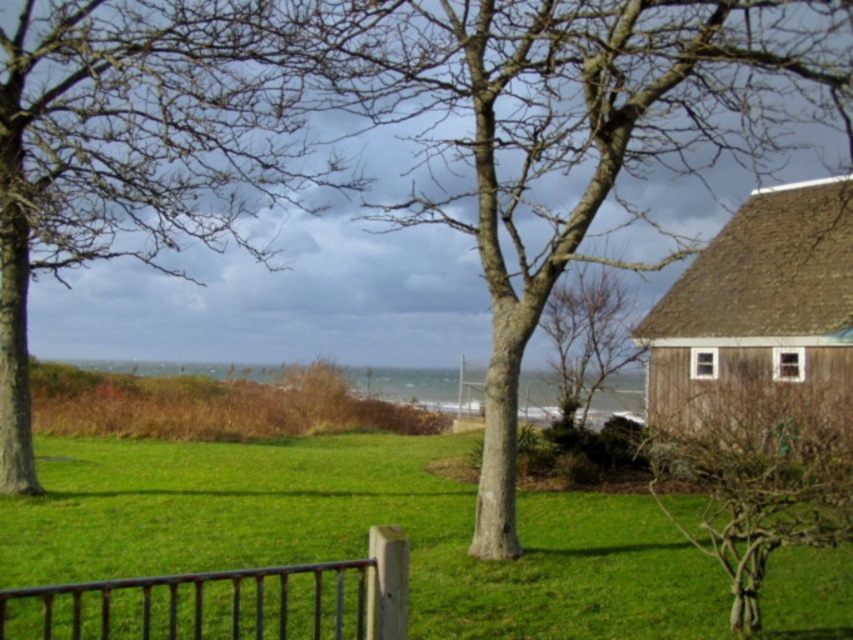
Does green grass at center appear over bare wood tree at center?

Actually, green grass at center is below bare wood tree at center.

Does green grass at center have a greater width compared to bare wood tree at center?

Indeed, green grass at center has a greater width compared to bare wood tree at center.

Identify the location of green grass at center. (361, 532).

This screenshot has height=640, width=853. I want to click on green grass at center, so click(361, 532).

Describe the element at coordinates (361, 532) in the screenshot. I see `green grass at center` at that location.

Is point (608, 595) farther from camera compared to point (746, 422)?

Yes, it is behind point (746, 422).

Locate an element on the screen. Image resolution: width=853 pixels, height=640 pixels. green grass at center is located at coordinates (361, 532).

Does smooth bark tree at left appear under brown wooden hut at right?

No.

Which is above, smooth bark tree at left or brown wooden hut at right?

smooth bark tree at left

Between point (149, 124) and point (749, 404), which one is positioned in front?

Point (749, 404) is in front.

Image resolution: width=853 pixels, height=640 pixels. I want to click on smooth bark tree at left, so click(x=137, y=147).